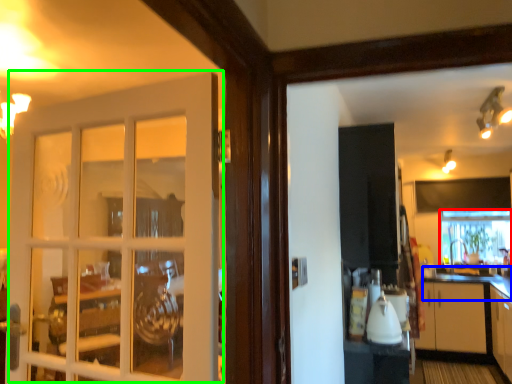
Question: Estimate the real-world distances between objects in this image. Which object is closer to window frame (highlighted by a red box), counter top (highlighted by a blue box) or door (highlighted by a green box)?

Choices:
 (A) counter top
 (B) door

Answer: (A)